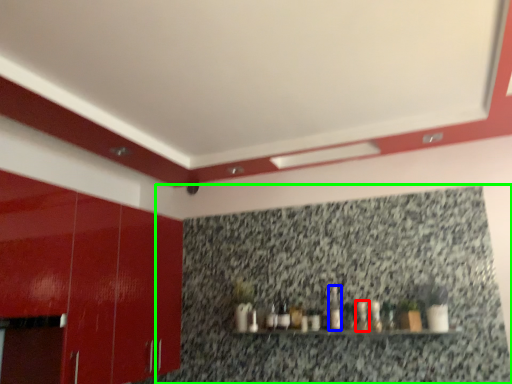
Question: Considering the real-world distances, which object is closest to bottle (highlighted by a red box)? bottle (highlighted by a blue box) or granite (highlighted by a green box).

Choices:
 (A) bottle
 (B) granite

Answer: (A)